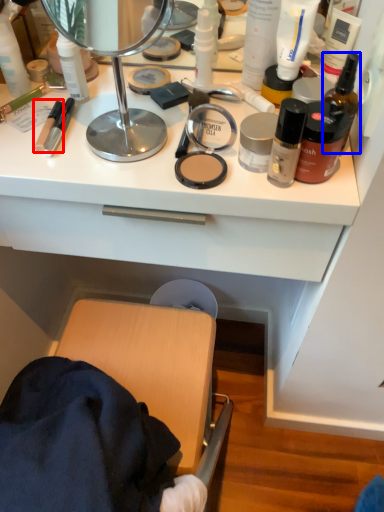
Question: Which of the following is the closest to the observer, toiletry (highlighted by a red box) or toiletry (highlighted by a blue box)?

Choices:
 (A) toiletry
 (B) toiletry

Answer: (B)